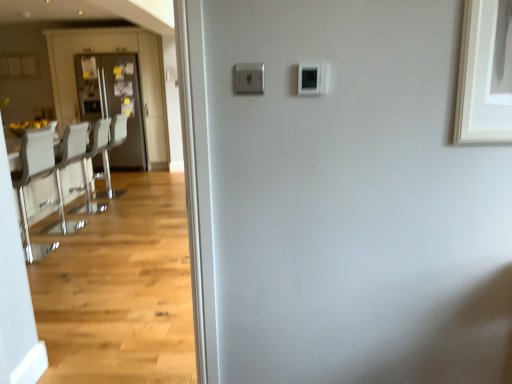
Question: From the image's perspective, is white leather chairs at left located above white glossy chair at left?

Choices:
 (A) no
 (B) yes

Answer: (B)

Question: Is white leather chairs at left to the right of white glossy chair at left from the viewer's perspective?

Choices:
 (A) no
 (B) yes

Answer: (B)

Question: Considering the relative sizes of white leather chairs at left and white glossy chair at left in the image provided, is white leather chairs at left smaller than white glossy chair at left?

Choices:
 (A) yes
 (B) no

Answer: (B)

Question: Is white leather chairs at left at the left side of white glossy chair at left?

Choices:
 (A) no
 (B) yes

Answer: (A)

Question: Is white leather chairs at left thinner than white glossy chair at left?

Choices:
 (A) no
 (B) yes

Answer: (A)

Question: Based on their sizes in the image, would you say matte black refrigerator at left is bigger or smaller than matte gray door at left?

Choices:
 (A) big
 (B) small

Answer: (A)

Question: Is point (92, 29) positioned closer to the camera than point (104, 110)?

Choices:
 (A) closer
 (B) farther

Answer: (A)

Question: Is matte black refrigerator at left to the left or to the right of matte gray door at left in the image?

Choices:
 (A) right
 (B) left

Answer: (B)

Question: From a real-world perspective, is matte black refrigerator at left positioned above or below matte gray door at left?

Choices:
 (A) above
 (B) below

Answer: (A)

Question: Based on their sizes in the image, would you say matte black refrigerator at left is bigger or smaller than white glossy chair at left?

Choices:
 (A) small
 (B) big

Answer: (B)

Question: From the image's perspective, is matte black refrigerator at left located above or below white glossy chair at left?

Choices:
 (A) below
 (B) above

Answer: (B)

Question: From their relative heights in the image, would you say matte black refrigerator at left is taller or shorter than white glossy chair at left?

Choices:
 (A) tall
 (B) short

Answer: (A)

Question: Based on their positions, is matte black refrigerator at left located to the left or right of white glossy chair at left?

Choices:
 (A) right
 (B) left

Answer: (B)

Question: Is white leather armchair at left, which appears as the second armchair when viewed from the front, taller or shorter than matte black refrigerator at left?

Choices:
 (A) tall
 (B) short

Answer: (B)

Question: From the image's perspective, relative to matte black refrigerator at left, is white leather armchair at left, which appears as the second armchair when viewed from the front, above or below?

Choices:
 (A) below
 (B) above

Answer: (A)